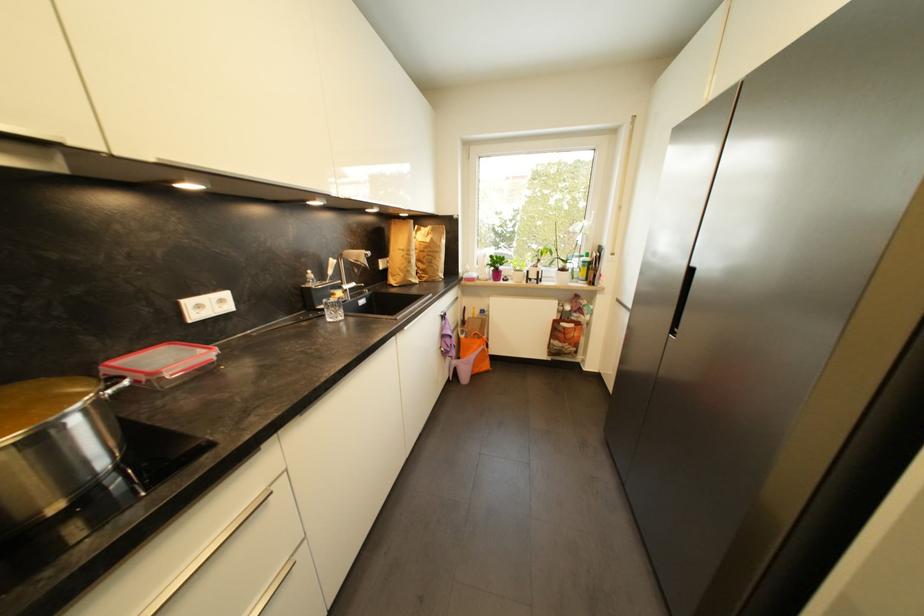
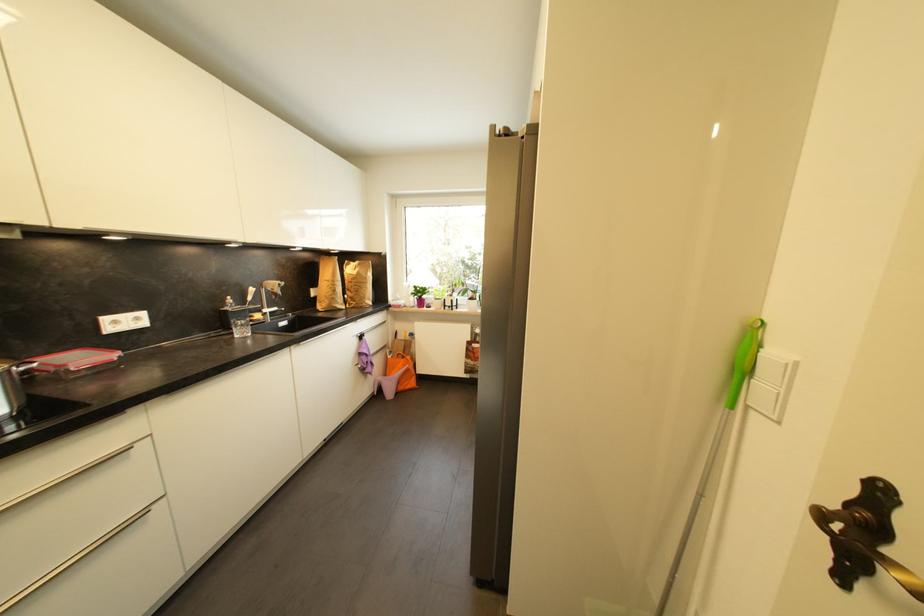
Find the pixel in the second image that matches the point at 339,317 in the first image.

(247, 334)